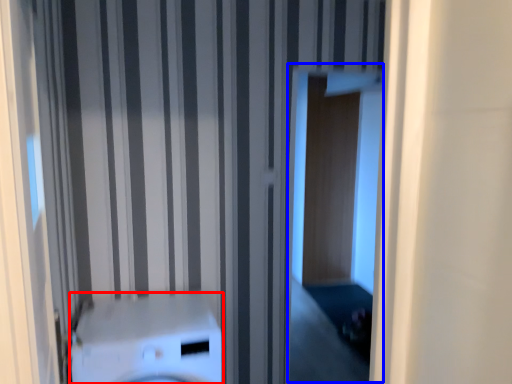
Question: Which point is closer to the camera, washer (highlighted by a red box) or screen door (highlighted by a blue box)?

Choices:
 (A) washer
 (B) screen door

Answer: (A)